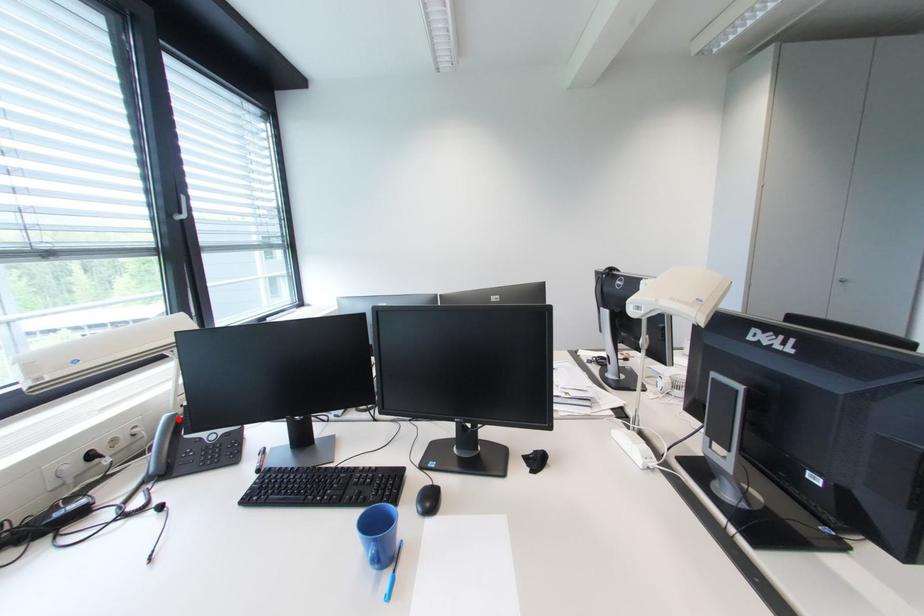
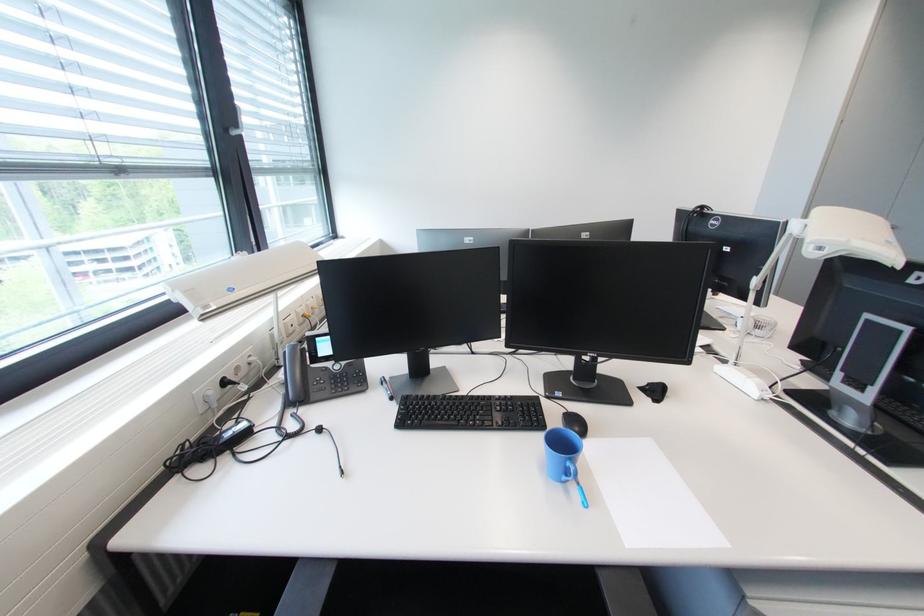
Where in the second image is the point corresponding to the highlighted location from the first image?

(300, 349)